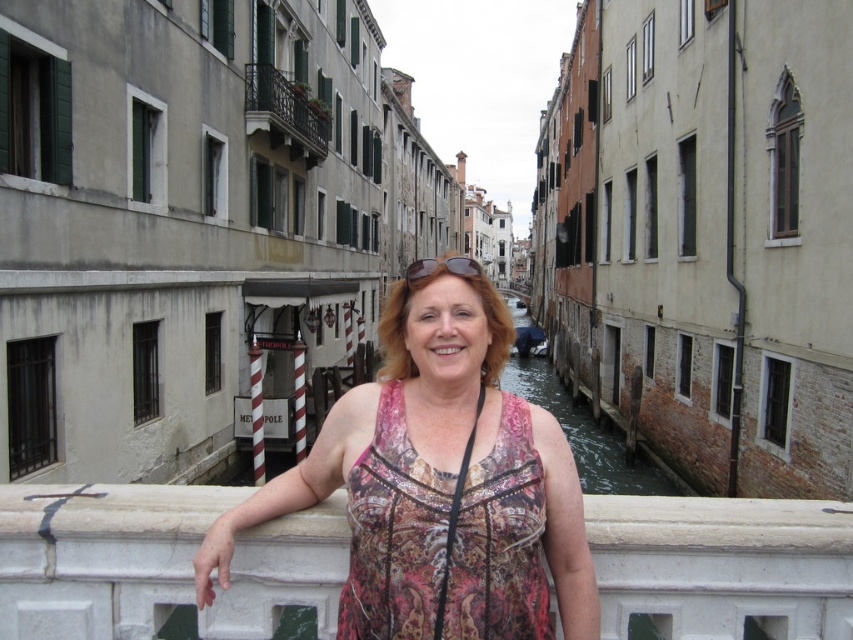
Question: Is printed silk dress at center above dark brown wrought iron balcony at upper left?

Choices:
 (A) no
 (B) yes

Answer: (A)

Question: Which of the following is the farthest from the observer?

Choices:
 (A) coord(509,368)
 (B) coord(531,531)
 (C) coord(270,128)
 (D) coord(227,557)

Answer: (A)

Question: Is printed silk dress at center to the left of greenish concrete canal at center from the viewer's perspective?

Choices:
 (A) yes
 (B) no

Answer: (A)

Question: Is greenish concrete canal at center below dark brown wrought iron balcony at upper left?

Choices:
 (A) yes
 (B) no

Answer: (A)

Question: Which point is closer to the camera?

Choices:
 (A) greenish concrete canal at center
 (B) printed silk dress at center

Answer: (B)

Question: Which object is positioned farthest from the printed fabric dress at center?

Choices:
 (A) printed silk dress at center
 (B) dark brown wrought iron balcony at upper left
 (C) greenish concrete canal at center

Answer: (C)